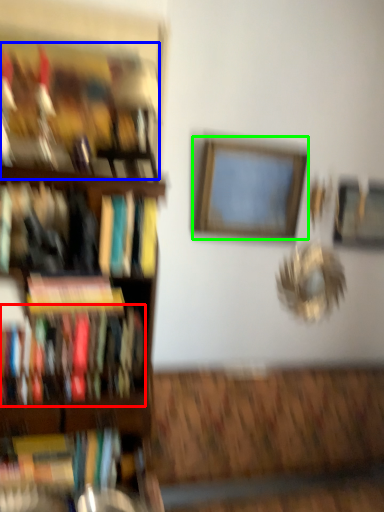
Question: Estimate the real-world distances between objects in this image. Which object is closer to book (highlighted by a red box), book (highlighted by a blue box) or picture frame (highlighted by a green box)?

Choices:
 (A) book
 (B) picture frame

Answer: (A)